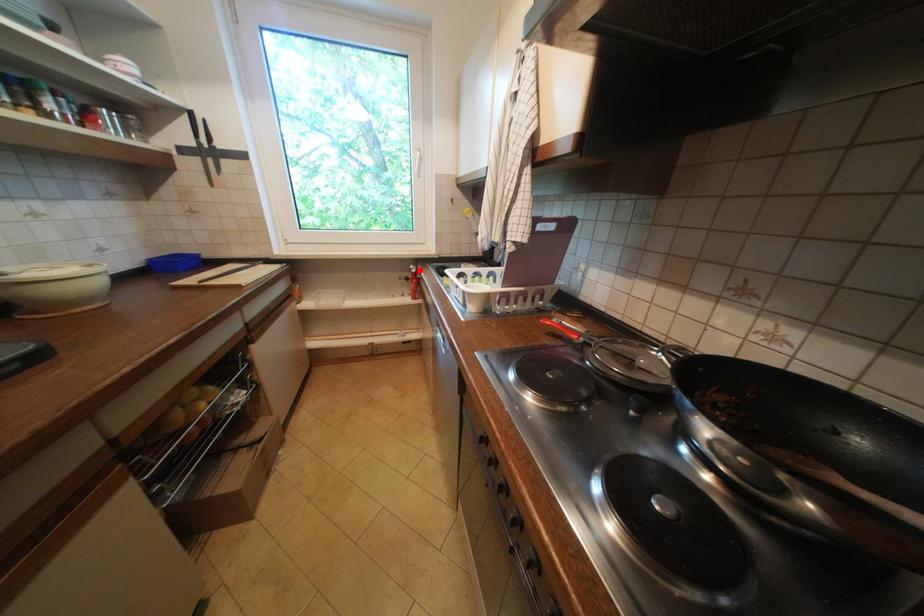
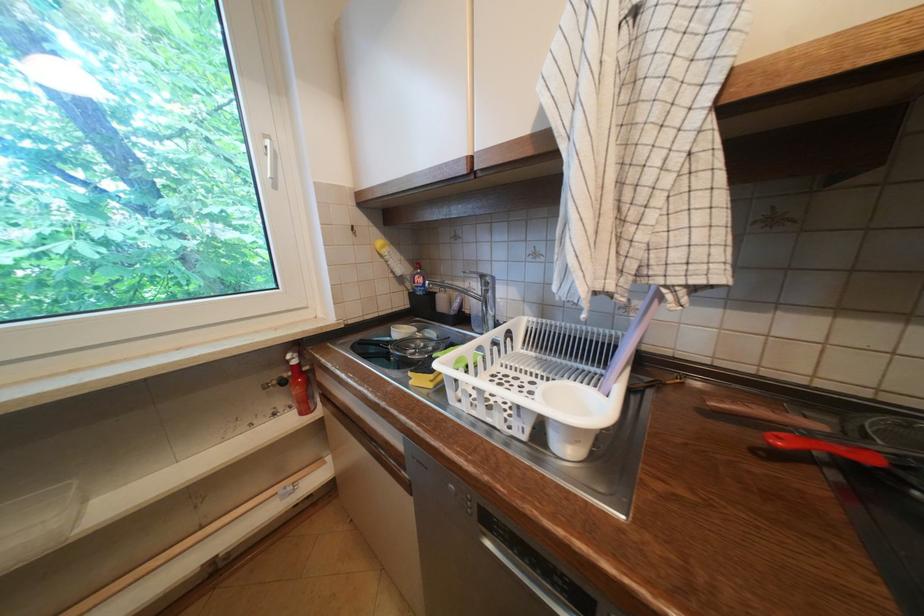
Find the pixel in the second image that matches the highlighted location in the first image.

(296, 362)